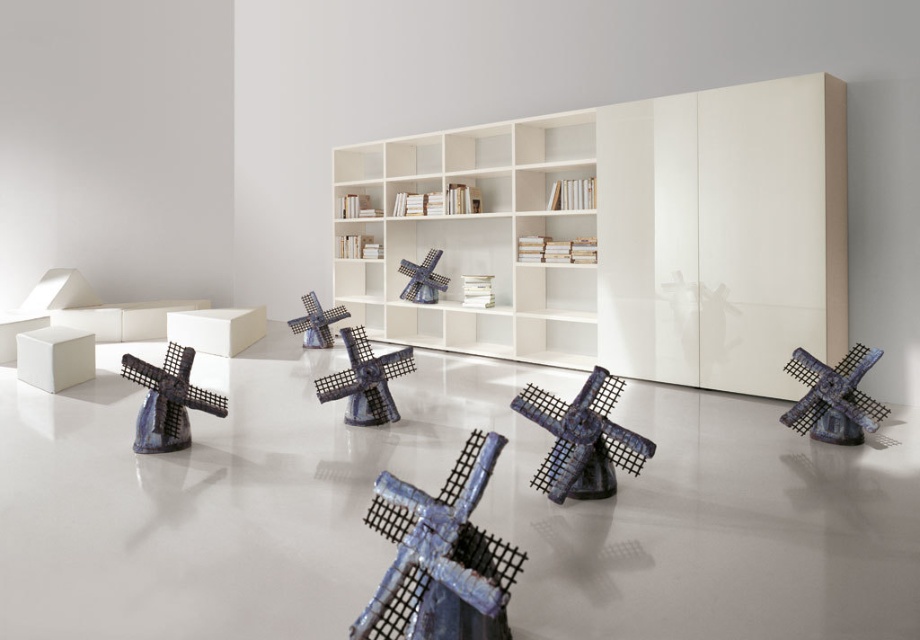
Question: Which point appears closest to the camera in this image?

Choices:
 (A) click(581, 444)
 (B) click(424, 152)

Answer: (A)

Question: Is white glossy bookcase at center below blue ceramic windmill at center?

Choices:
 (A) yes
 (B) no

Answer: (B)

Question: Based on their relative distances, which object is nearer to the shiny blue windmill at center?

Choices:
 (A) white glossy bookshelf at center
 (B) blue metallic windmill at center

Answer: (B)

Question: Which point appears farthest from the camera in this image?

Choices:
 (A) (521, 195)
 (B) (553, 477)
 (C) (322, 381)
 (D) (359, 240)

Answer: (D)

Question: Does shiny blue windmill at center lie in front of white glossy bookshelf at center?

Choices:
 (A) no
 (B) yes

Answer: (B)

Question: Is shiny blue windmill at center wider than white glossy bookshelf at center?

Choices:
 (A) no
 (B) yes

Answer: (B)